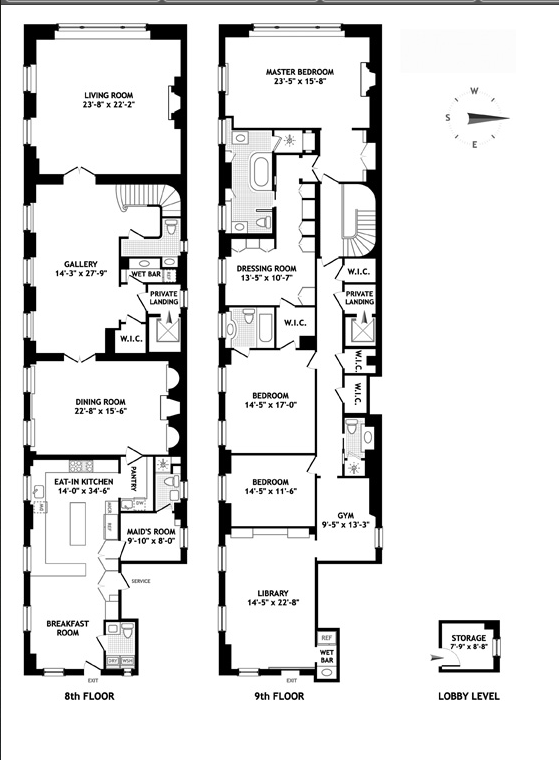
In order to click on toilet in this screenshot , I will do `click(129, 632)`, `click(170, 220)`, `click(355, 423)`.